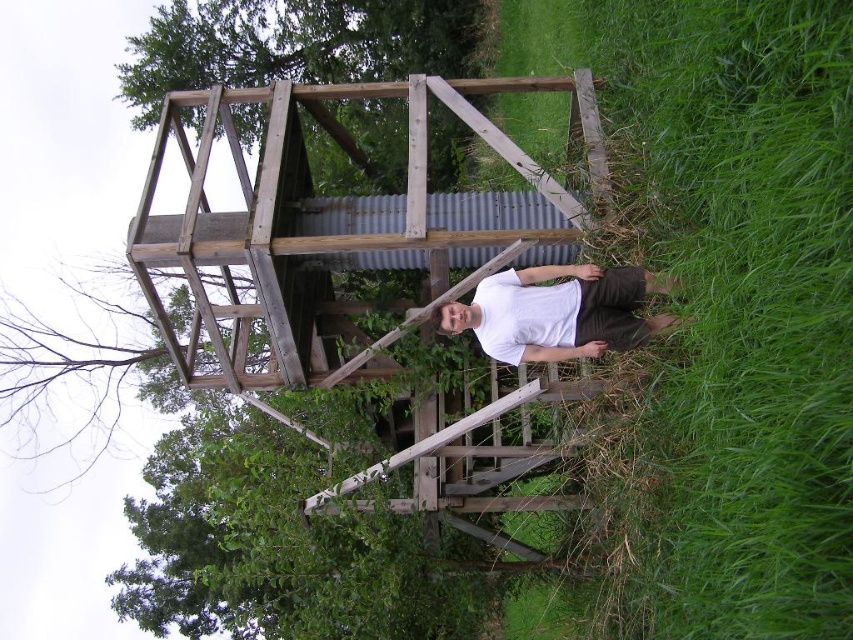
Question: Can you confirm if wooden frame at center is smaller than white matte shirt at center?

Choices:
 (A) no
 (B) yes

Answer: (B)

Question: Is wooden frame at center thinner than brown wooden structure at upper center?

Choices:
 (A) yes
 (B) no

Answer: (A)

Question: Does green grass at right appear over wooden frame at center?

Choices:
 (A) yes
 (B) no

Answer: (B)

Question: Which point appears farthest from the camera in this image?

Choices:
 (A) (341, 61)
 (B) (636, 276)
 (C) (426, 492)
 (D) (822, 548)

Answer: (A)

Question: Among these points, which one is farthest from the camera?

Choices:
 (A) (521, 333)
 (B) (323, 332)

Answer: (B)

Question: Which of the following is the closest to the observer?

Choices:
 (A) (408, 148)
 (B) (126, 90)
 (C) (543, 353)
 (D) (830, 164)

Answer: (D)